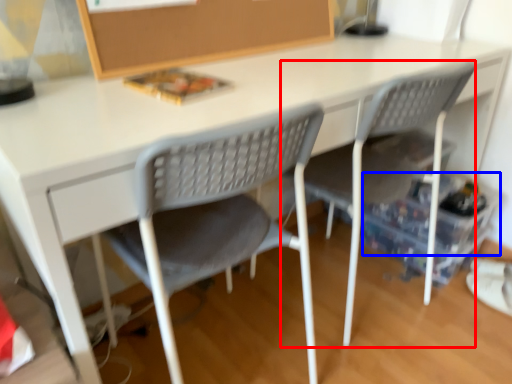
Question: Among these objects, which one is nearest to the camera, chair (highlighted by a red box) or storage box (highlighted by a blue box)?

Choices:
 (A) chair
 (B) storage box

Answer: (A)